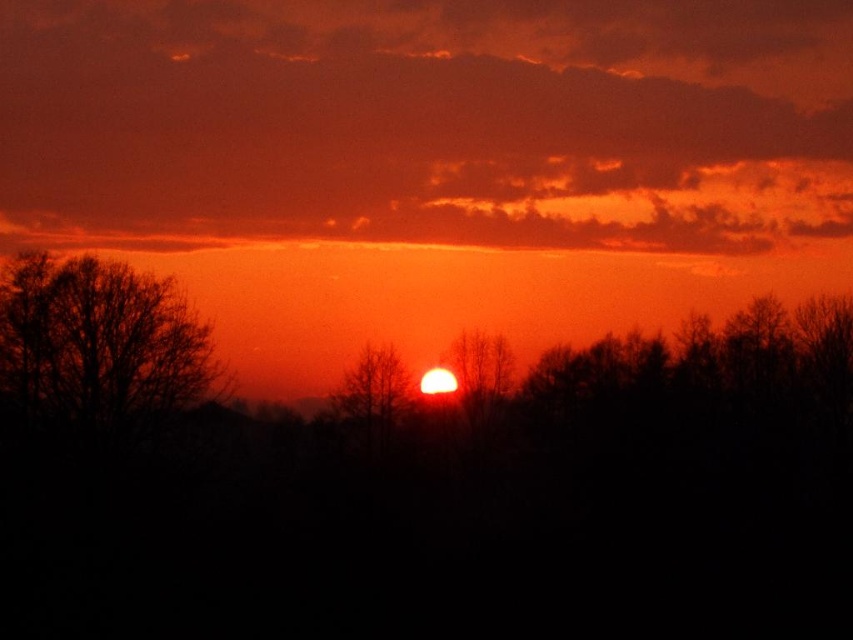
Question: Does matte orange cloud at upper center lie in front of silhouette bare tree at left?

Choices:
 (A) no
 (B) yes

Answer: (A)

Question: Does silhouette bare tree at left lie behind silhouette tree at center?

Choices:
 (A) yes
 (B) no

Answer: (B)

Question: Does silhouette tree at center have a greater width compared to silhouette bare tree at center?

Choices:
 (A) no
 (B) yes

Answer: (B)

Question: Among these objects, which one is nearest to the camera?

Choices:
 (A) matte orange cloud at upper center
 (B) silhouette bare tree at left

Answer: (B)

Question: Which object is closer to the camera taking this photo?

Choices:
 (A) matte orange cloud at upper center
 (B) silhouette tree at center
 (C) silhouette bare tree at center
 (D) silhouette bare tree at left

Answer: (D)

Question: Which object is farther from the camera taking this photo?

Choices:
 (A) silhouette tree at center
 (B) matte orange cloud at upper center

Answer: (B)